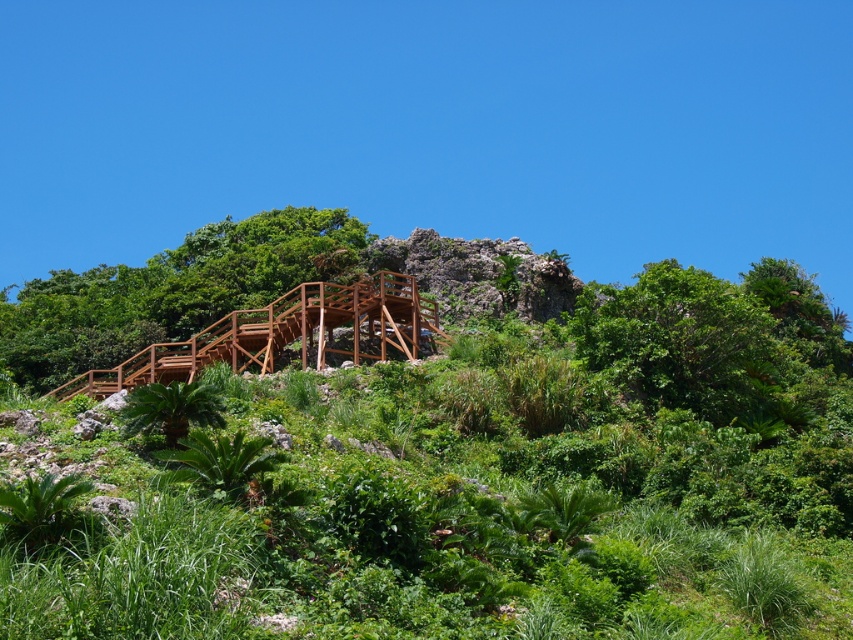
From the picture: Does brown wooden staircase at upper center appear on the left side of green leafy plant at lower left?

Indeed, brown wooden staircase at upper center is positioned on the left side of green leafy plant at lower left.

Is brown wooden staircase at upper center shorter than green leafy plant at lower left?

No, brown wooden staircase at upper center is not shorter than green leafy plant at lower left.

Is point (343, 228) behind point (195, 404)?

Yes, it is behind point (195, 404).

Find the location of a particular element. The height and width of the screenshot is (640, 853). brown wooden staircase at upper center is located at coordinates (170, 291).